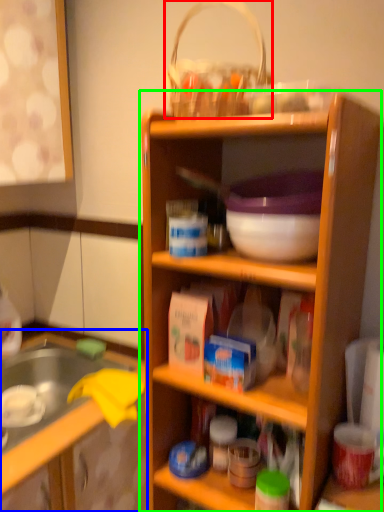
Question: Which object is the closest to the basket (highlighted by a red box)? Choose among these: cabinetry (highlighted by a blue box) or shelf (highlighted by a green box).

Choices:
 (A) cabinetry
 (B) shelf

Answer: (B)